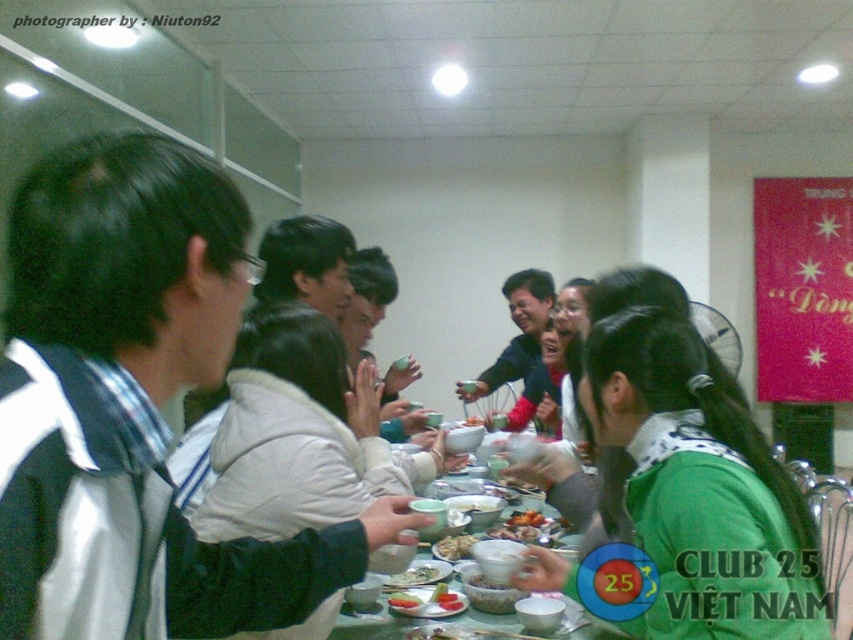
You are standing at the center of the room and see the point marked at coordinate (688, 497). Which object is this point located on?

The point marked at coordinate (688, 497) is located on the green matte shirt at center.

You are standing at the edge of the table in the image and want to reach both the point at coordinate (572, 544) and the point at coordinate (434, 550). Which point will you reach first as you move towards them?

You will reach point (572, 544) first because it is closer to you than point (434, 550), which is further away.

You are planning to place a decorative centerpiece on the green glossy table at center. Considering the size of the table and the smooth white rice bowl at center, can you estimate whether the table has enough space for the centerpiece without displacing the rice bowl?

The green glossy table at center is larger in size than the smooth white rice bowl at center, so there is sufficient space to place a decorative centerpiece on the table without displacing the rice bowl.